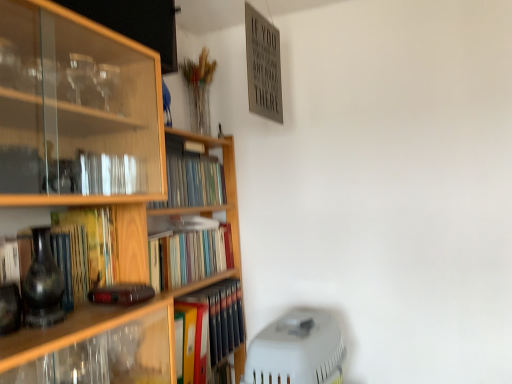
Question: Is multicolored hardcover books at center, which is the first book in bottom-to-top order, at the left side of wooden bookshelf at left?

Choices:
 (A) no
 (B) yes

Answer: (A)

Question: Does multicolored hardcover books at center, acting as the 4th book starting from the top, appear on the right side of wooden bookshelf at left?

Choices:
 (A) yes
 (B) no

Answer: (A)

Question: Is multicolored hardcover books at center, acting as the 4th book starting from the top, smaller than wooden bookshelf at left?

Choices:
 (A) no
 (B) yes

Answer: (B)

Question: Is multicolored hardcover books at center, which is the first book in bottom-to-top order, thinner than wooden bookshelf at left?

Choices:
 (A) no
 (B) yes

Answer: (B)

Question: Is there a large distance between multicolored hardcover books at center, which is the first book in bottom-to-top order, and wooden bookshelf at left?

Choices:
 (A) no
 (B) yes

Answer: (A)

Question: Do you think multicolored hardcover books at center, which is the first book in bottom-to-top order, is within matte black vase at left, or outside of it?

Choices:
 (A) inside
 (B) outside

Answer: (B)

Question: From the image's perspective, is multicolored hardcover books at center, which is the first book in bottom-to-top order, located above or below matte black vase at left?

Choices:
 (A) above
 (B) below

Answer: (B)

Question: Is point tap(221, 339) closer or farther from the camera than point tap(31, 304)?

Choices:
 (A) farther
 (B) closer

Answer: (A)

Question: In the image, is multicolored hardcover books at center, which is the first book in bottom-to-top order, positioned in front of or behind matte black vase at left?

Choices:
 (A) behind
 (B) front

Answer: (A)

Question: Is hardcover books at center, which is the first book in top-to-bottom order, taller or shorter than multicolored hardcover books at center, acting as the 4th book starting from the top?

Choices:
 (A) tall
 (B) short

Answer: (B)

Question: From a real-world perspective, is hardcover books at center, acting as the 4th book starting from the bottom, above or below multicolored hardcover books at center, which is the first book in bottom-to-top order?

Choices:
 (A) below
 (B) above

Answer: (B)

Question: Is point (221, 192) closer or farther from the camera than point (228, 304)?

Choices:
 (A) farther
 (B) closer

Answer: (A)

Question: Relative to multicolored hardcover books at center, acting as the 4th book starting from the top, is hardcover books at center, acting as the 4th book starting from the bottom, in front or behind?

Choices:
 (A) behind
 (B) front

Answer: (B)

Question: From the image's perspective, is matte black vase at left located above or below hardcover book at center-left, acting as the second book starting from the top?

Choices:
 (A) below
 (B) above

Answer: (B)

Question: Is point (36, 278) positioned closer to the camera than point (66, 294)?

Choices:
 (A) closer
 (B) farther

Answer: (A)